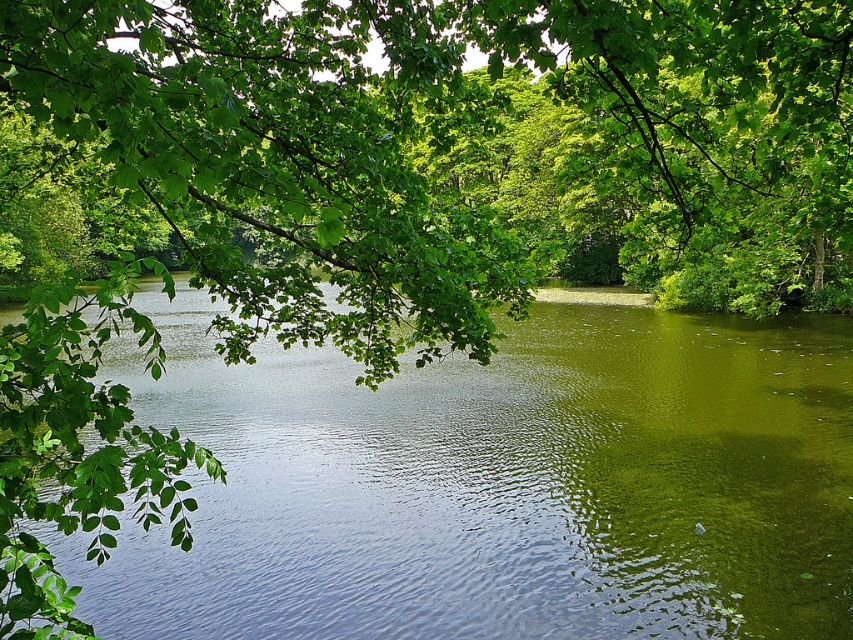
Question: Can you confirm if green leafy branch at upper center is thinner than green smooth water at center?

Choices:
 (A) yes
 (B) no

Answer: (A)

Question: Is green leafy branch at upper center to the right of green smooth water at center from the viewer's perspective?

Choices:
 (A) yes
 (B) no

Answer: (A)

Question: Is green leafy branch at upper center bigger than green smooth water at center?

Choices:
 (A) yes
 (B) no

Answer: (A)